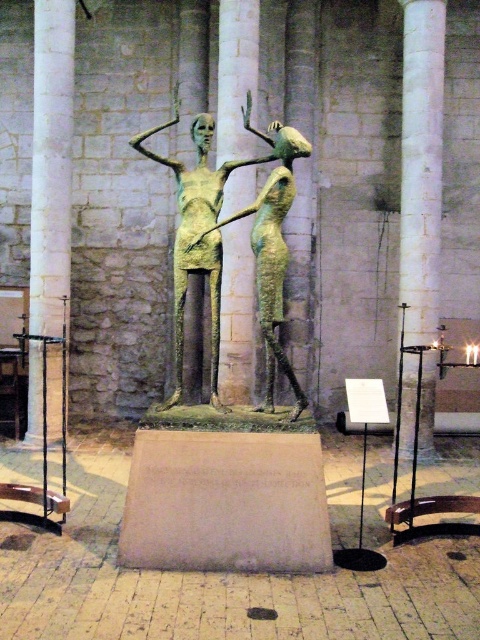
You are an architect designing a new exhibit space. You need to place a new display case that requires 2 meters of clearance between the white marble pillar at right and the bronze statue at center. Is there enough space between them?

The white marble pillar at right is bigger than bronze statue at center, but the question is about the distance between them. The provided information does not specify the actual distance between the white marble pillar at right and the bronze statue at center, so it is impossible to determine if there is enough space for the display case requiring 2 meters of clearance.

You are standing in the historical building and want to move towards the bronze sculpture of two figures. There is a white stone column at left at point (50, 163). Can you walk directly towards the sculpture without passing through the column?

The white stone column at left is located at point (50, 163). Since the column is to the left of your path, you can walk directly towards the bronze sculpture without passing through the column as long as you stay to the right of the column.

You are an art curator planning to install a new lighting system in the room. The green patina bronze sculpture at center and the bronze statue at center are both important pieces. Since you want to ensure both are well lit, which one requires a taller light fixture to adequately illuminate its height?

The bronze statue at center requires a taller light fixture because it has a greater height than the green patina bronze sculpture at center.